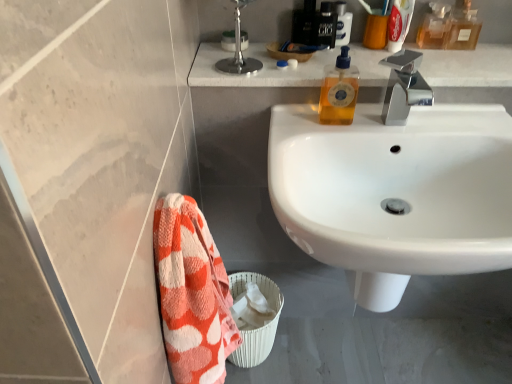
Where is `free space to the right of shiny black bottle at upper center, the 2th toiletry in the front-to-back sequence`? free space to the right of shiny black bottle at upper center, the 2th toiletry in the front-to-back sequence is located at coordinates (393, 56).